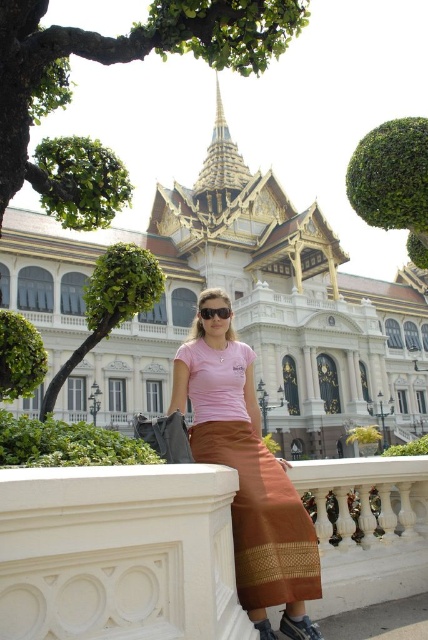
Between white marble ledge at lower center and pink fabric skirt at center, which one is positioned lower?

white marble ledge at lower center is below.

Is point (321, 577) positioned in front of point (196, 412)?

Yes, it is in front of point (196, 412).

Locate an element on the screen. white marble ledge at lower center is located at coordinates (118, 554).

Does gold metallic palace at center lie in front of white marble ledge at lower center?

No, gold metallic palace at center is further to the viewer.

In order to click on gold metallic palace at center in this screenshot , I will do `click(234, 307)`.

Describe the element at coordinates (234, 307) in the screenshot. I see `gold metallic palace at center` at that location.

This screenshot has height=640, width=428. I want to click on gold metallic palace at center, so click(234, 307).

Is point (329, 429) farther from viewer compared to point (214, 316)?

Yes, point (329, 429) is behind point (214, 316).

Is gold metallic palace at center below black matte sunglasses at center?

No.

This screenshot has width=428, height=640. What do you see at coordinates (234, 307) in the screenshot?
I see `gold metallic palace at center` at bounding box center [234, 307].

At what (x,y) coordinates should I click in order to perform the action: click on gold metallic palace at center. Please return your answer as a coordinate pair (x, y). Image resolution: width=428 pixels, height=640 pixels. Looking at the image, I should click on (234, 307).